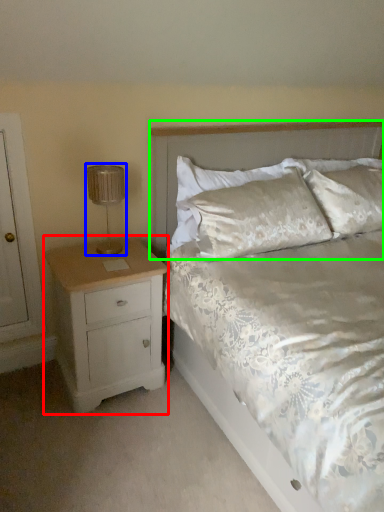
Question: Based on their relative distances, which object is nearer to nightstand (highlighted by a red box)? Choose from lamp (highlighted by a blue box) and headboard (highlighted by a green box).

Choices:
 (A) lamp
 (B) headboard

Answer: (A)